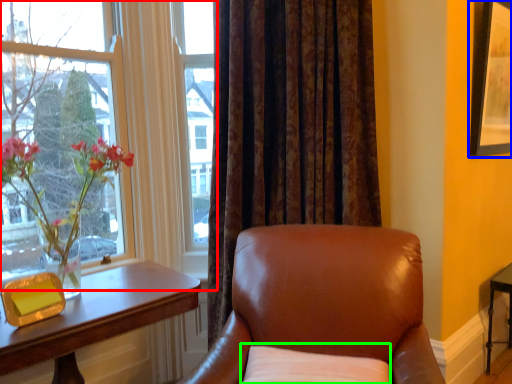
Question: Which object is the closest to the window (highlighted by a red box)? Choose among these: picture frame (highlighted by a blue box) or pillow (highlighted by a green box).

Choices:
 (A) picture frame
 (B) pillow

Answer: (B)